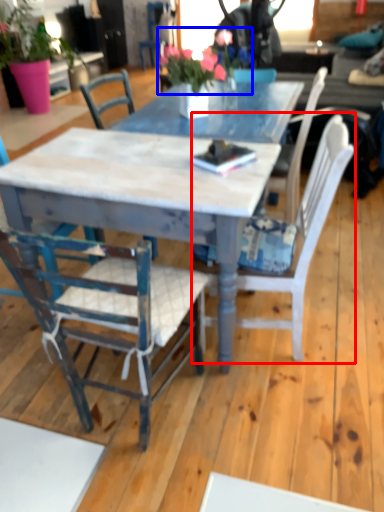
Question: Among these objects, which one is nearest to the camera, chair (highlighted by a red box) or floral arrangement (highlighted by a blue box)?

Choices:
 (A) chair
 (B) floral arrangement

Answer: (A)